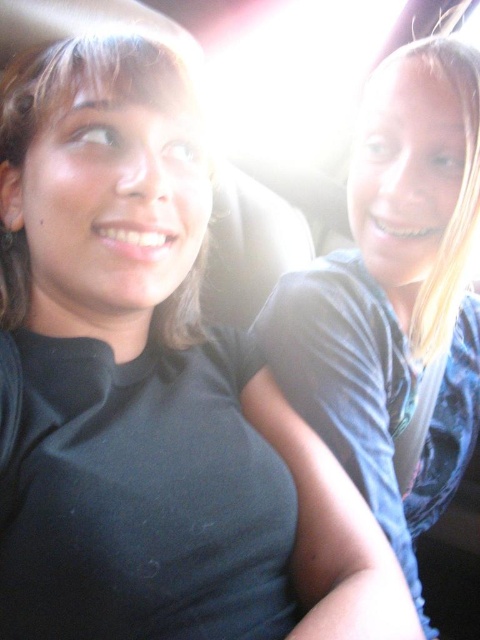
Question: Which of the following is the farthest from the observer?

Choices:
 (A) (142, 74)
 (B) (431, 225)

Answer: (B)

Question: Which point is farther from the camera taking this photo?

Choices:
 (A) (x=113, y=90)
 (B) (x=362, y=193)

Answer: (B)

Question: Which point is farther to the camera?

Choices:
 (A) (468, 56)
 (B) (2, 234)

Answer: (A)

Question: Can you confirm if blue fabric shirt at right is positioned to the left of matte black hair at upper left?

Choices:
 (A) no
 (B) yes

Answer: (A)

Question: Can you confirm if blue fabric shirt at right is positioned above matte black hair at upper left?

Choices:
 (A) yes
 (B) no

Answer: (B)

Question: Can you confirm if blue fabric shirt at right is smaller than matte black hair at upper left?

Choices:
 (A) yes
 (B) no

Answer: (B)